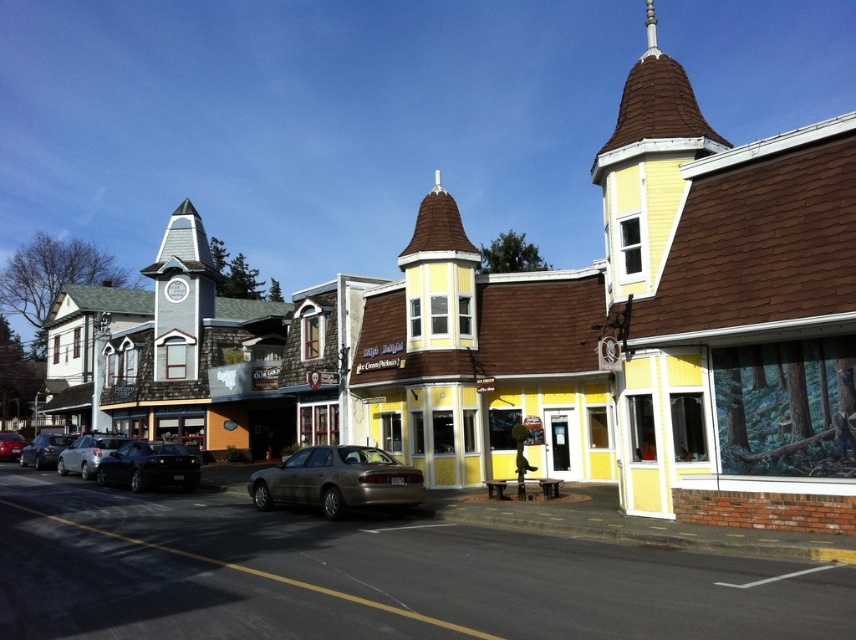
Who is shorter, yellow wood building at center or shiny black sedan at left?

shiny black sedan at left

Between point (801, 384) and point (134, 458), which one is positioned in front?

Point (801, 384)

Between point (745, 260) and point (179, 481), which one is positioned in front?

Point (745, 260)

Image resolution: width=856 pixels, height=640 pixels. In order to click on yellow wood building at center in this screenshot , I will do `click(646, 326)`.

Can you confirm if shiny black sedan at left is shorter than satin silver sedan at left?

Indeed, shiny black sedan at left has a lesser height compared to satin silver sedan at left.

Who is shorter, shiny black sedan at left or satin silver sedan at left?

shiny black sedan at left

In order to click on shiny black sedan at left in this screenshot , I will do `click(149, 467)`.

Who is shorter, shiny black sedan at left or silver metallic sedan at left?

shiny black sedan at left is shorter.

Is shiny black sedan at left shorter than silver metallic sedan at left?

Yes, shiny black sedan at left is shorter than silver metallic sedan at left.

This screenshot has width=856, height=640. Find the location of `shiny black sedan at left`. shiny black sedan at left is located at coordinates (149, 467).